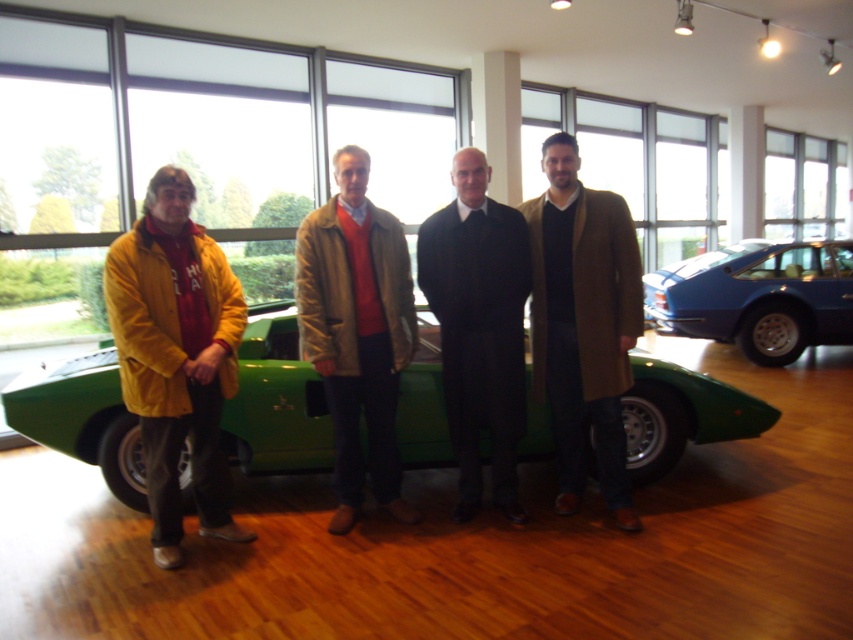
You are a photographer standing in the showroom. You need to take a photo of the green matte car at center and the yellow suede jacket at left. Since you can only focus on one object at a time, which object should you focus on first to ensure it is in the foreground?

The yellow suede jacket at left should be focused on first because it is closer to the photographer, being to the left of the green matte car at center which is further right.

You are standing in the showroom and want to locate the green matte car at center. What are the coordinates where you should look?

The green matte car at center is located at coordinates point (276, 404).

You are a photographer wanting to capture both the green matte car at center and the blue metallic car at right in a single shot. Since you can only focus on one car at a time, which car should you focus on to ensure the other remains in the background?

You should focus on the green matte car at center because it is in front of the blue metallic car at right, so the blue metallic car at right will naturally be in the background.